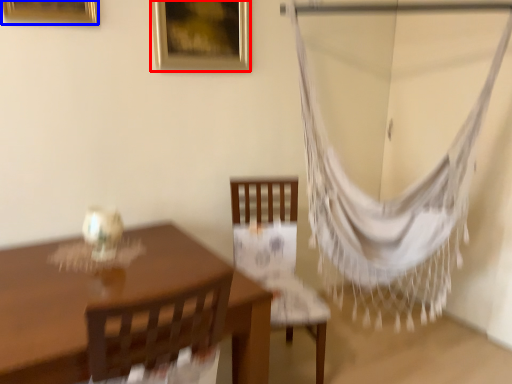
Question: Which object is closer to the camera taking this photo, picture frame (highlighted by a red box) or picture frame (highlighted by a blue box)?

Choices:
 (A) picture frame
 (B) picture frame

Answer: (B)